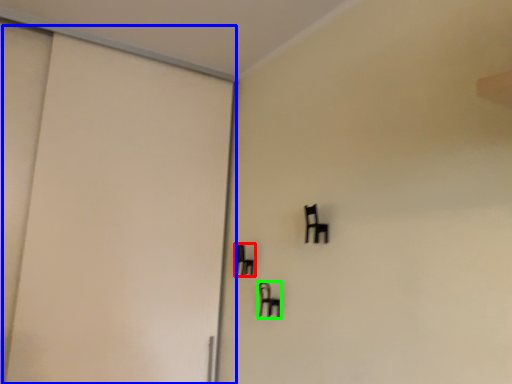
Question: Based on their relative distances, which object is farther from furniture (highlighted by a red box)? Choose from door (highlighted by a blue box) and furniture (highlighted by a green box).

Choices:
 (A) door
 (B) furniture

Answer: (A)